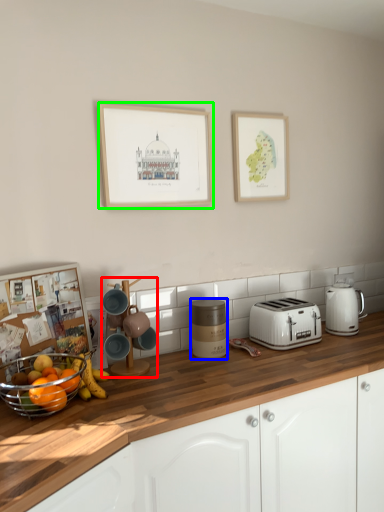
Question: Which object is the farthest from coffee machine (highlighted by a red box)? Choose among these: appliance (highlighted by a blue box) or picture frame (highlighted by a green box).

Choices:
 (A) appliance
 (B) picture frame

Answer: (B)